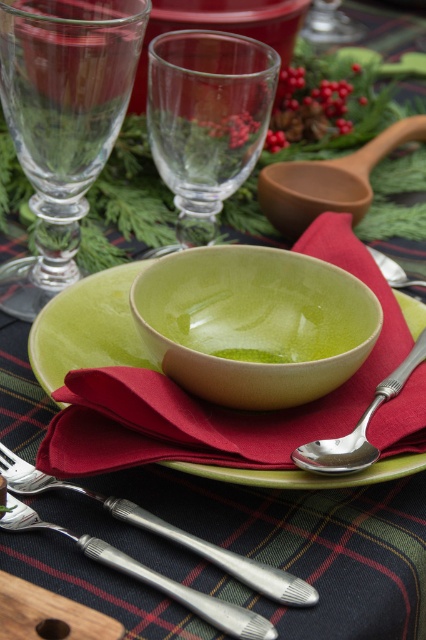
Looking at this image, measure the distance between point (207, 390) and camera.

Point (207, 390) is 12.37 inches from camera.

Is green glazed bowl at center closer to the viewer compared to transparent glass wine glass at upper center?

Yes.

The image size is (426, 640). Describe the element at coordinates (255, 323) in the screenshot. I see `green glazed bowl at center` at that location.

The height and width of the screenshot is (640, 426). What are the coordinates of `green glazed bowl at center` in the screenshot? It's located at (255, 323).

Is point (250, 323) behind point (313, 589)?

Yes, it is behind point (313, 589).

This screenshot has height=640, width=426. I want to click on green glazed bowl at center, so click(255, 323).

Does green matte plate at center appear on the left side of silver metallic spoon at lower right?

Indeed, green matte plate at center is positioned on the left side of silver metallic spoon at lower right.

Does point (54, 387) come in front of point (393, 384)?

Yes, point (54, 387) is closer to viewer.

Between point (279, 472) and point (311, 454), which one is positioned in front?

Point (279, 472) is in front.

Locate an element on the screen. The width and height of the screenshot is (426, 640). green matte plate at center is located at coordinates (89, 326).